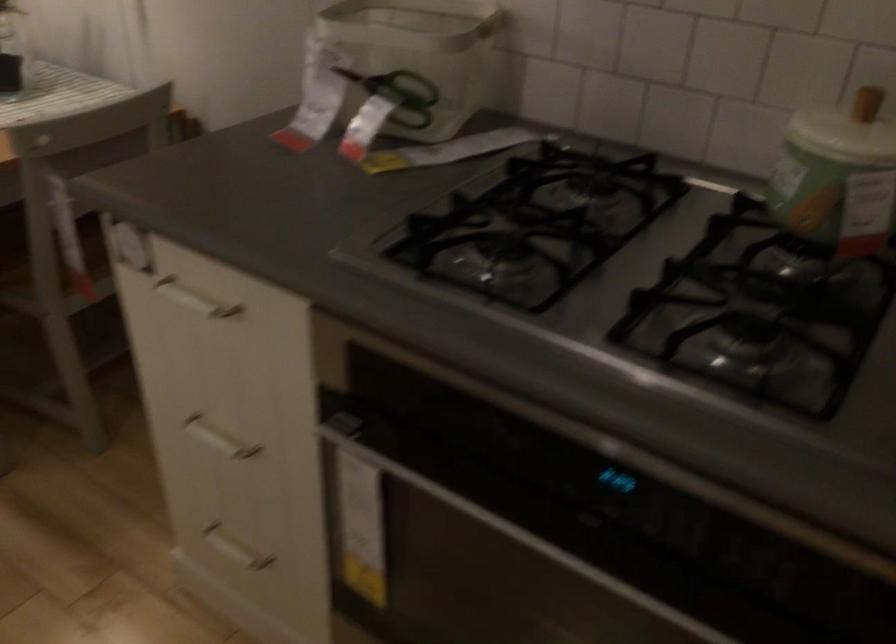
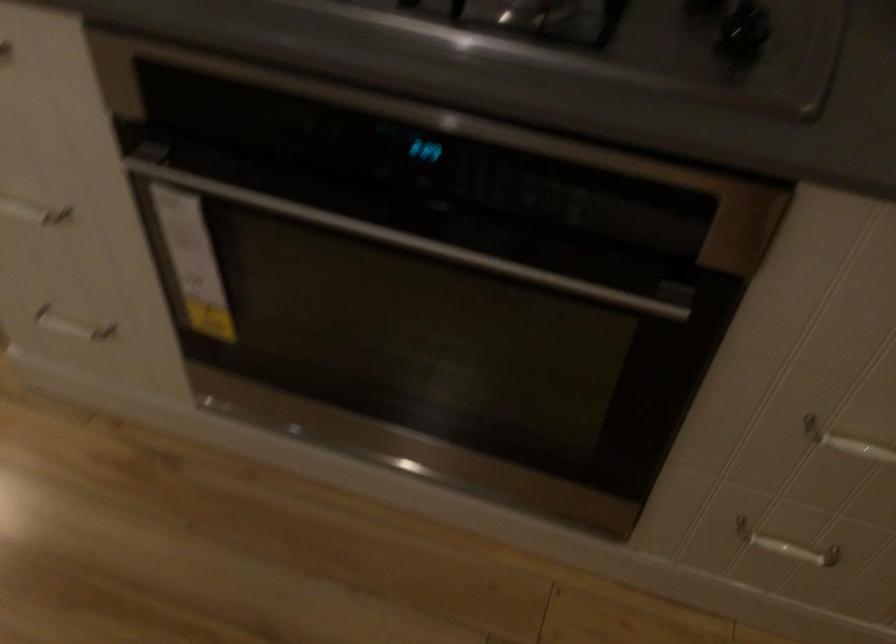
Question: The first image is from the beginning of the video and the second image is from the end. How did the camera likely rotate when shooting the video?

Choices:
 (A) Left
 (B) Right
 (C) Up
 (D) Down

Answer: (D)